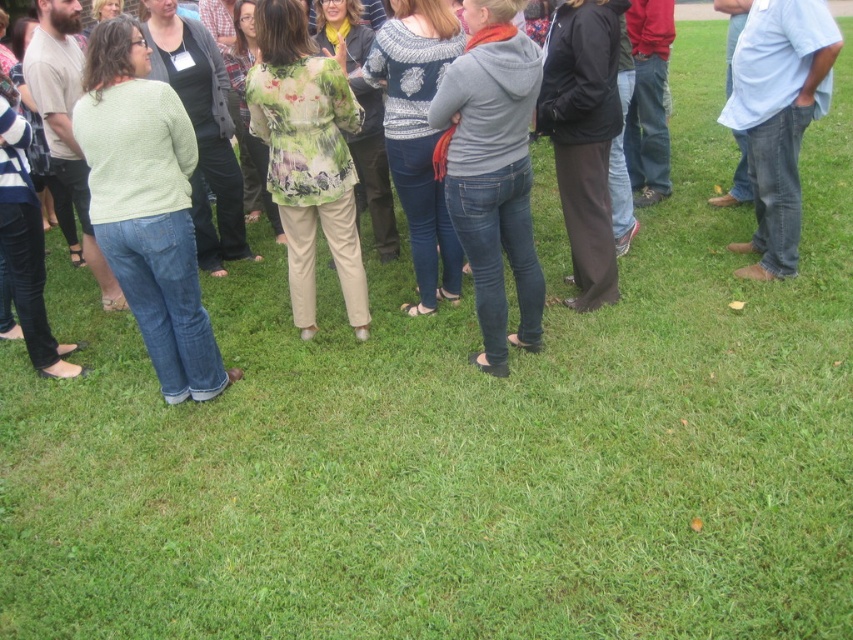
Question: Among these objects, which one is farthest from the camera?

Choices:
 (A) light green knitted sweater at center
 (B) blue jeans at right

Answer: (B)

Question: Is gray fleece hoodie at center positioned behind floral-patterned blouse at center?

Choices:
 (A) no
 (B) yes

Answer: (A)

Question: Can you confirm if light green knitted sweater at center is wider than floral-patterned blouse at center?

Choices:
 (A) yes
 (B) no

Answer: (A)

Question: Which object appears closest to the camera in this image?

Choices:
 (A) blue jeans at right
 (B) light green knitted sweater at center
 (C) gray fleece hoodie at center

Answer: (B)

Question: Which point appears farthest from the camera in this image?

Choices:
 (A) (459, 161)
 (B) (814, 10)
 (C) (111, 35)

Answer: (B)

Question: Can you confirm if light green knitted sweater at center is bigger than blue jeans at right?

Choices:
 (A) no
 (B) yes

Answer: (A)